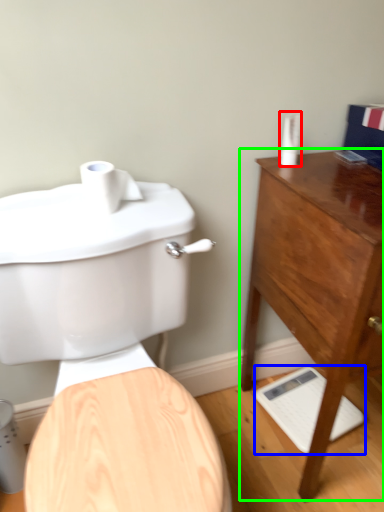
Question: Which object is the farthest from toiletry (highlighted by a red box)? Choose among these: porcelain (highlighted by a blue box) or chest of drawers (highlighted by a green box).

Choices:
 (A) porcelain
 (B) chest of drawers

Answer: (A)